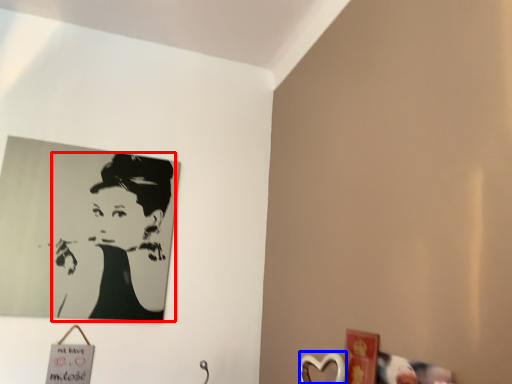
Question: Which object appears farthest to the camera in this image, woman (highlighted by a red box) or picture frame (highlighted by a blue box)?

Choices:
 (A) woman
 (B) picture frame

Answer: (A)